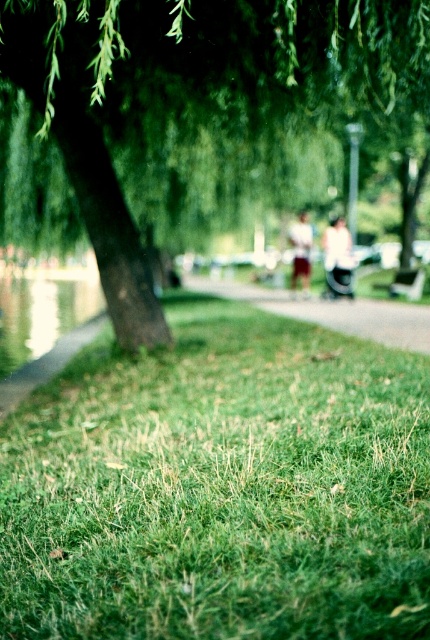
Question: Does smooth asphalt path at center have a greater width compared to wooden park bench at center?

Choices:
 (A) no
 (B) yes

Answer: (B)

Question: Which point is closer to the camera?

Choices:
 (A) smooth asphalt path at center
 (B) green grassy at lower center
 (C) clear glass water at lower left
 (D) green leafy tree at center

Answer: (B)

Question: Estimate the real-world distances between objects in this image. Which object is closer to the smooth asphalt path at center?

Choices:
 (A) wooden park bench at center
 (B) green leafy tree at center
 (C) clear glass water at lower left
 (D) green grassy at lower center

Answer: (A)

Question: Considering the real-world distances, which object is farthest from the green grassy at lower center?

Choices:
 (A) green leafy tree at center
 (B) smooth asphalt path at center
 (C) wooden park bench at center

Answer: (C)

Question: Does smooth asphalt path at center appear over clear glass water at lower left?

Choices:
 (A) no
 (B) yes

Answer: (B)

Question: Is the position of green leafy tree at center less distant than that of clear glass water at lower left?

Choices:
 (A) yes
 (B) no

Answer: (A)